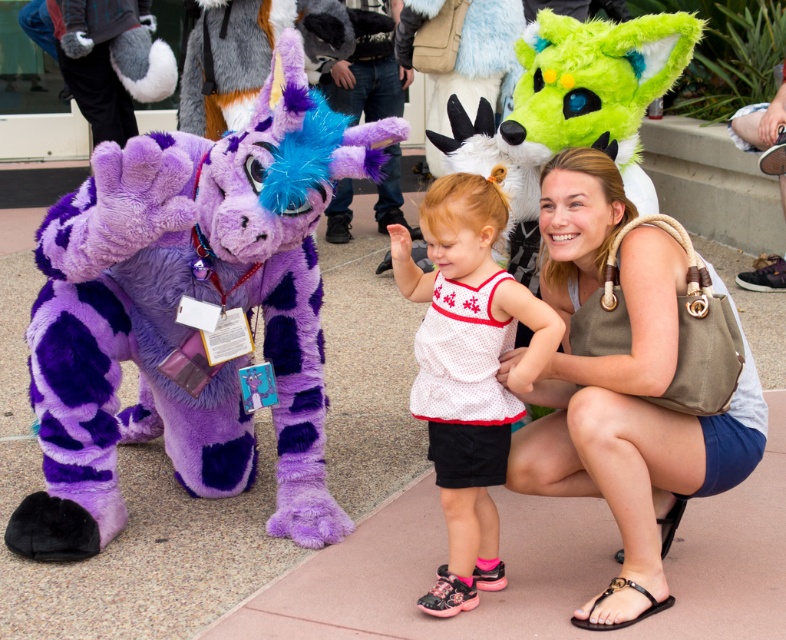
Question: Does olive-green fabric purse at center-right have a lesser width compared to white mesh top at center?

Choices:
 (A) yes
 (B) no

Answer: (B)

Question: Which point appears farthest from the camera in this image?

Choices:
 (A) (164, 396)
 (B) (658, 604)
 (C) (542, 365)

Answer: (A)

Question: Which object is positioned closest to the purple plush at left?

Choices:
 (A) olive-green fabric purse at center-right
 (B) white mesh top at center

Answer: (B)

Question: Which point is farther to the camera?

Choices:
 (A) (725, 419)
 (B) (452, 534)

Answer: (B)

Question: Can you confirm if olive-green fabric purse at center-right is bigger than white mesh top at center?

Choices:
 (A) yes
 (B) no

Answer: (A)

Question: Does purple plush at left appear under olive-green fabric purse at center-right?

Choices:
 (A) yes
 (B) no

Answer: (B)